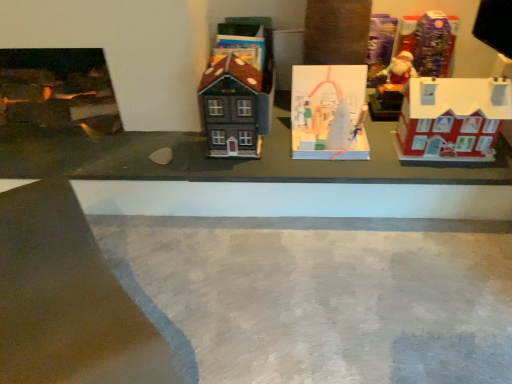
This screenshot has width=512, height=384. I want to click on blank area to the left of matte red house at right, placed as the 2th toy when sorted from right to left, so click(390, 156).